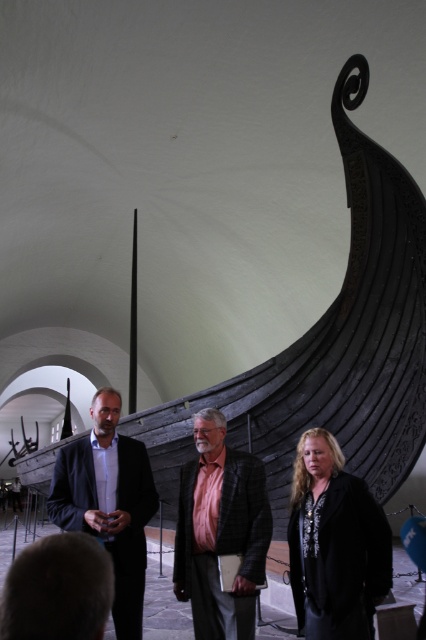
You are standing in the museum and want to touch the closest point between the two points, point (340, 566) and point (134, 560). Which point should you aim for?

Point (340, 566) is closer to the viewer than point (134, 560), so you should aim for point (340, 566).

You are a photographer positioned at the entrance of the museum. You want to capture a photo of the pink textured shirt at center and the matte black suit at center such that they are both in focus. The camera you are using has a depth of field that can sharply focus on objects within a 36 inch range. Will both subjects be in focus if you focus on the midpoint between them?

The pink textured shirt at center and matte black suit at center are 37.27 inches apart. The camera can focus within a 36 inch range. Since the distance between them exceeds the camera range, focusing on the midpoint would place each subject 18.63 inches from the focus point. This is within the 36 inch range, so both would be in focus.